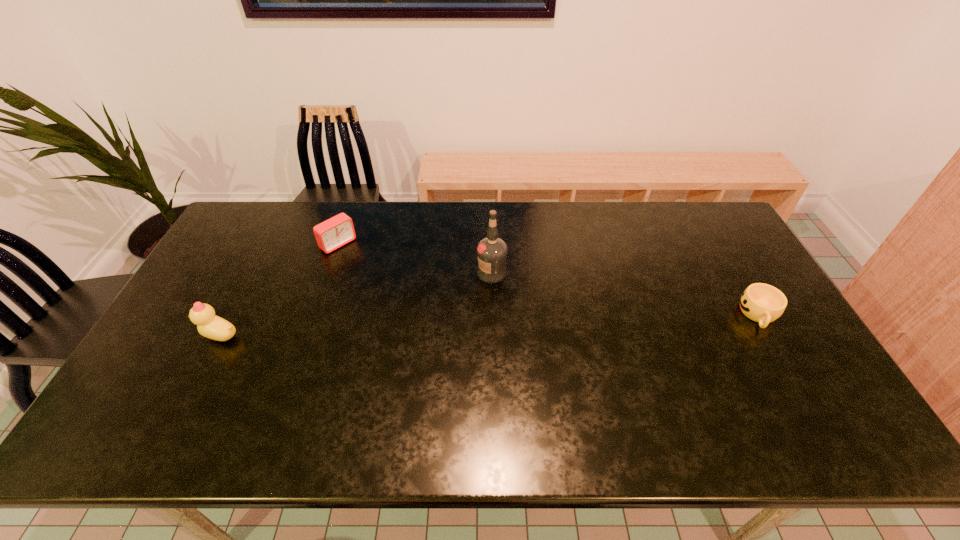
You are a GUI agent. You are given a task and a screenshot of the screen. Output one action in this format:
    pyautogui.click(x=<x>, y=<y>)
    Task: Click on the duckling
    This screenshot has width=960, height=540.
    Given the screenshot: What is the action you would take?
    pyautogui.click(x=209, y=325)

Where is `the leftmost object`? This screenshot has width=960, height=540. the leftmost object is located at coordinates pyautogui.click(x=209, y=325).

Where is `the rightmost object`? the rightmost object is located at coordinates point(760,302).

Find the location of a particular element. cup is located at coordinates (760, 302).

At what (x,y) coordinates should I click in order to perform the action: click on the second object from right to left. Please return your answer as a coordinate pair (x, y). Looking at the image, I should click on (492, 251).

At what (x,y) coordinates should I click in order to perform the action: click on the tallest object. Please return your answer as a coordinate pair (x, y). The width and height of the screenshot is (960, 540). Looking at the image, I should click on (492, 251).

Locate an element on the screen. the third object from right to left is located at coordinates (337, 231).

The image size is (960, 540). Identify the location of the second shortest object. (337, 231).

You are a GUI agent. You are given a task and a screenshot of the screen. Output one action in this format:
    pyautogui.click(x=<x>, y=<y>)
    Task: Click on the free space located on the left of the rightmost object
    
    Given the screenshot: What is the action you would take?
    pyautogui.click(x=629, y=315)

The width and height of the screenshot is (960, 540). What are the coordinates of `free space located on the front label of the second farthest object` in the screenshot? It's located at (455, 323).